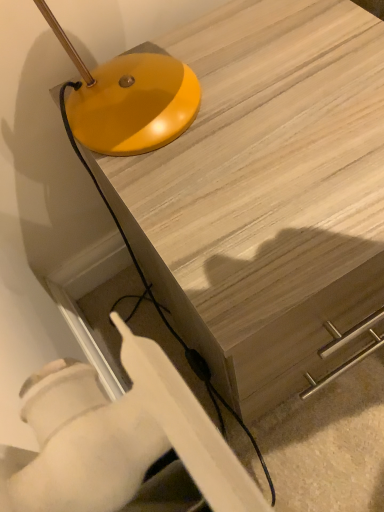
Identify the location of vacant area that is situated to the right of matte yellow lampshade at upper left. (295, 75).